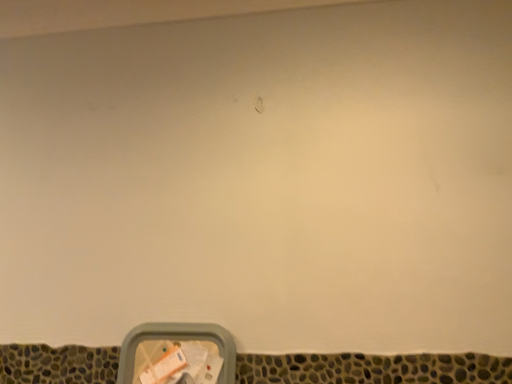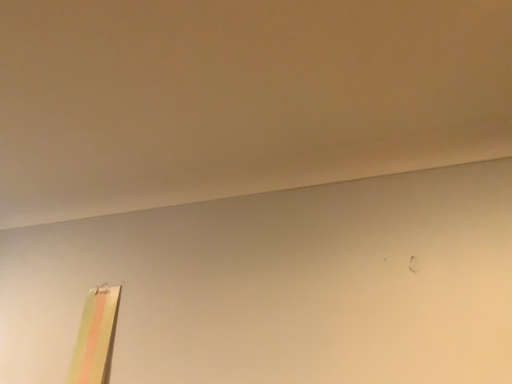
Question: Which way did the camera rotate in the video?

Choices:
 (A) rotated left
 (B) rotated right

Answer: (A)